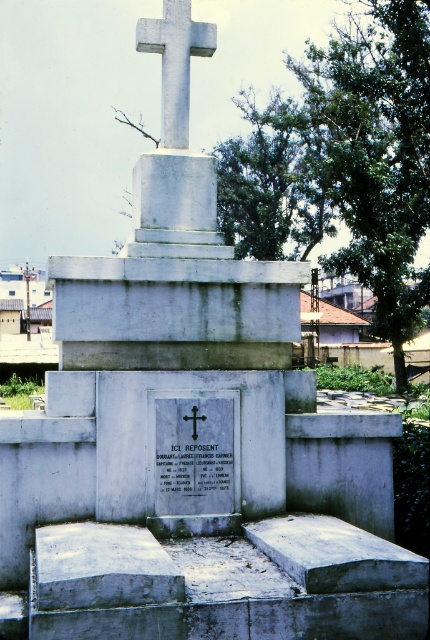
Question: Is white stone cross at upper center wider than white stone cross at center?

Choices:
 (A) no
 (B) yes

Answer: (B)

Question: Which object is farther from the camera taking this photo?

Choices:
 (A) white stone cross at upper center
 (B) white stone cross at center

Answer: (A)

Question: Does white stone cross at upper center appear on the left side of white stone cross at center?

Choices:
 (A) no
 (B) yes

Answer: (B)

Question: Is white stone cross at upper center wider than white stone cross at center?

Choices:
 (A) no
 (B) yes

Answer: (B)